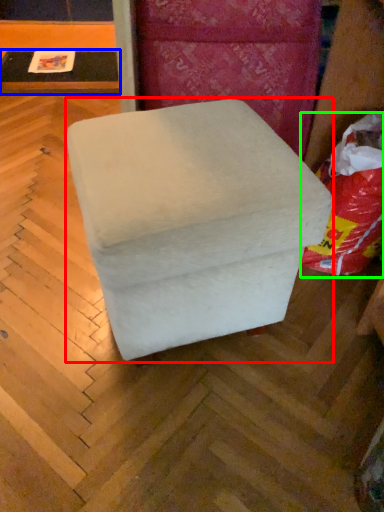
Question: Which object is the farthest from furniture (highlighted by a red box)? Choose among these: table (highlighted by a blue box) or bean bag chair (highlighted by a green box).

Choices:
 (A) table
 (B) bean bag chair

Answer: (A)